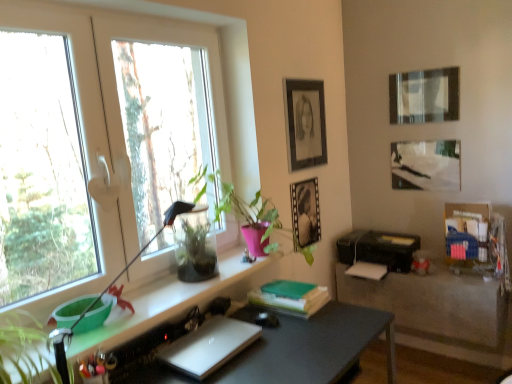
Locate an element on the screen. free space in front of green matte book at center is located at coordinates (294, 333).